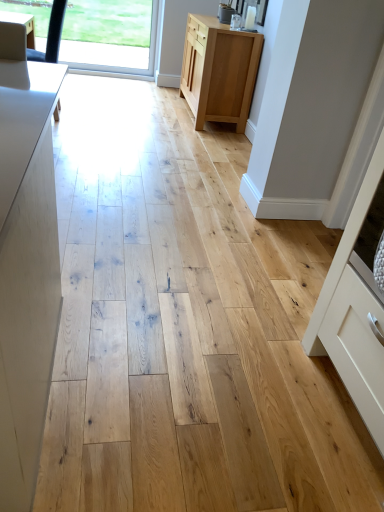
Question: Considering the positions of white matte cabinet at right, the first cabinetry positioned from the front, and natural wood cabinet at center, marked as the first cabinetry in a back-to-front arrangement, in the image, is white matte cabinet at right, the first cabinetry positioned from the front, bigger or smaller than natural wood cabinet at center, marked as the first cabinetry in a back-to-front arrangement,?

Choices:
 (A) small
 (B) big

Answer: (A)

Question: Do you think white matte cabinet at right, the 1th cabinetry positioned from the right, is within natural wood cabinet at center, which is the first cabinetry from top to bottom, or outside of it?

Choices:
 (A) inside
 (B) outside

Answer: (B)

Question: Which object is positioned farthest from the natural wood cabinet at center, arranged as the 2th cabinetry when viewed from the right?

Choices:
 (A) transparent glass window at upper left
 (B) white matte cabinet at right, the 2th cabinetry in the back-to-front sequence

Answer: (B)

Question: Estimate the real-world distances between objects in this image. Which object is closer to the natural wood cabinet at center, which appears as the second cabinetry when ordered from the bottom?

Choices:
 (A) transparent glass window at upper left
 (B) white matte cabinet at right, the 2th cabinetry when ordered from top to bottom

Answer: (A)